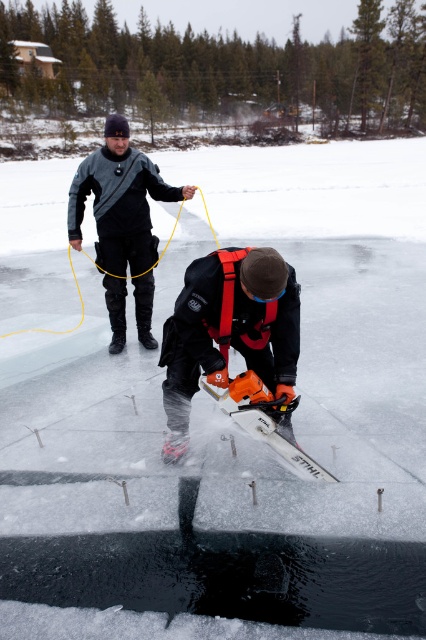
Is orange rubber gloves at center below orange plastic chainsaw at center?

Incorrect, orange rubber gloves at center is not positioned below orange plastic chainsaw at center.

Who is higher up, orange rubber gloves at center or orange plastic chainsaw at center?

Positioned higher is orange rubber gloves at center.

Where is `orange rubber gloves at center`? Image resolution: width=426 pixels, height=640 pixels. orange rubber gloves at center is located at coordinates (229, 330).

In the scene shown: Who is lower down, orange rubber gloves at center or matte black jacket at upper center?

orange rubber gloves at center is below.

Between orange rubber gloves at center and matte black jacket at upper center, which one is positioned higher?

matte black jacket at upper center is higher up.

The width and height of the screenshot is (426, 640). What do you see at coordinates (229, 330) in the screenshot?
I see `orange rubber gloves at center` at bounding box center [229, 330].

What are the coordinates of `orange rubber gloves at center` in the screenshot? It's located at (229, 330).

Describe the element at coordinates (123, 212) in the screenshot. Image resolution: width=426 pixels, height=640 pixels. I see `matte black jacket at upper center` at that location.

Consider the image. Does matte black jacket at upper center have a lesser width compared to orange plastic chainsaw at center?

In fact, matte black jacket at upper center might be wider than orange plastic chainsaw at center.

Where is `matte black jacket at upper center`? matte black jacket at upper center is located at coordinates (123, 212).